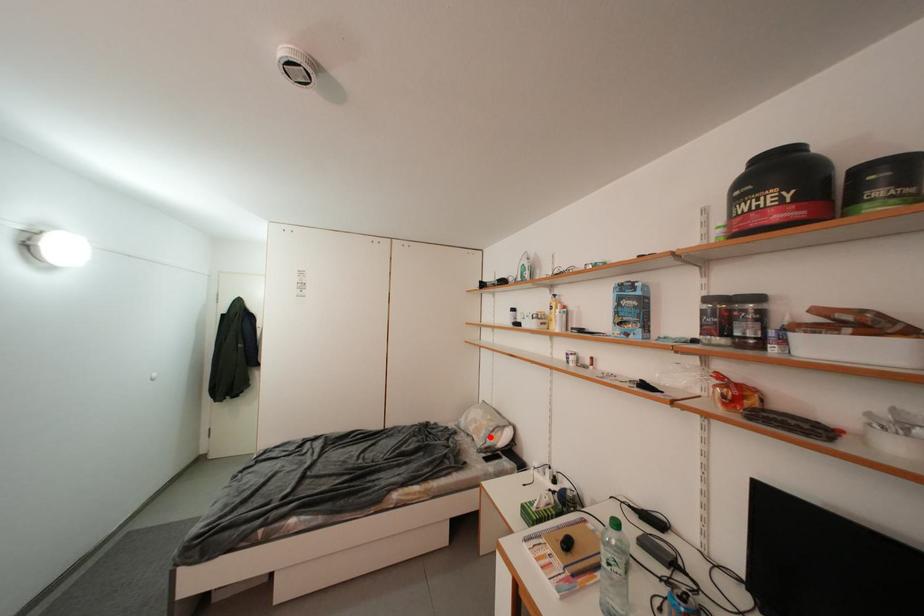
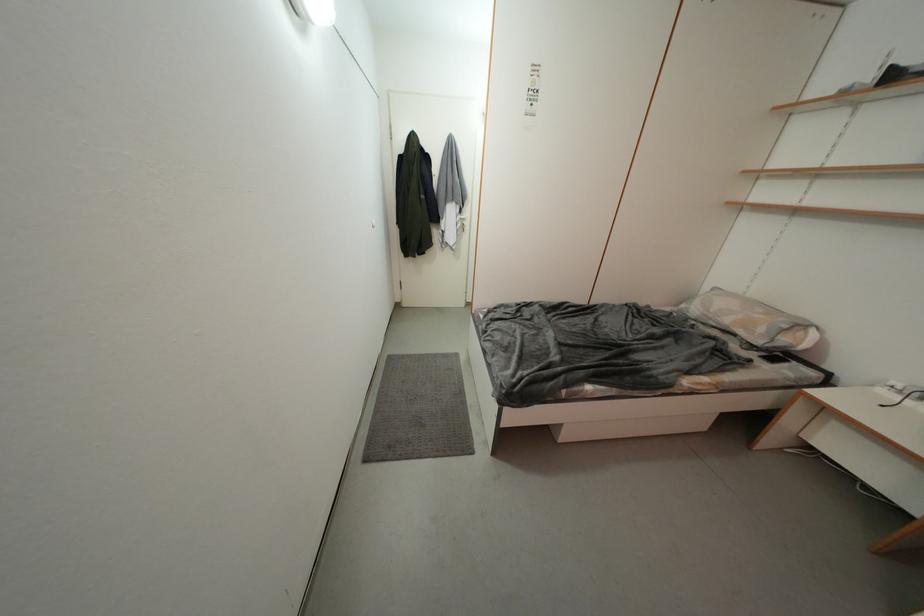
In the second image, find the point that corresponds to the highlighted location in the first image.

(769, 333)